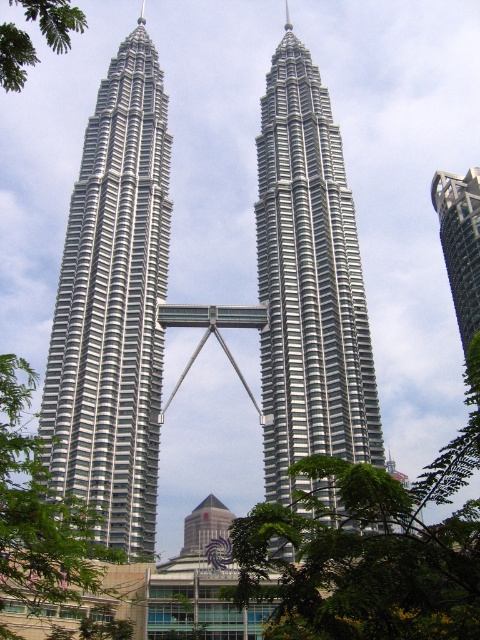
Does point (455, 541) come farther from viewer compared to point (19, 45)?

No.

Measure the distance between green leafy tree at center and green leafy tree at upper left.

44.66 meters

Is point (237, 534) positioned in front of point (20, 68)?

No.

The image size is (480, 640). I want to click on green leafy tree at center, so click(x=371, y=547).

Does point (103, 480) come behind point (466, 323)?

That is False.

The image size is (480, 640). In order to click on polished steel skyscraper at center in this screenshot , I will do `click(113, 307)`.

Find the location of a particular element. polished steel skyscraper at center is located at coordinates (113, 307).

Between green leafy tree at left and green leafy tree at upper left, which one appears on the right side from the viewer's perspective?

green leafy tree at left

Locate an element on the screen. The image size is (480, 640). green leafy tree at left is located at coordinates (39, 513).

Identify the location of green leafy tree at left. (39, 513).